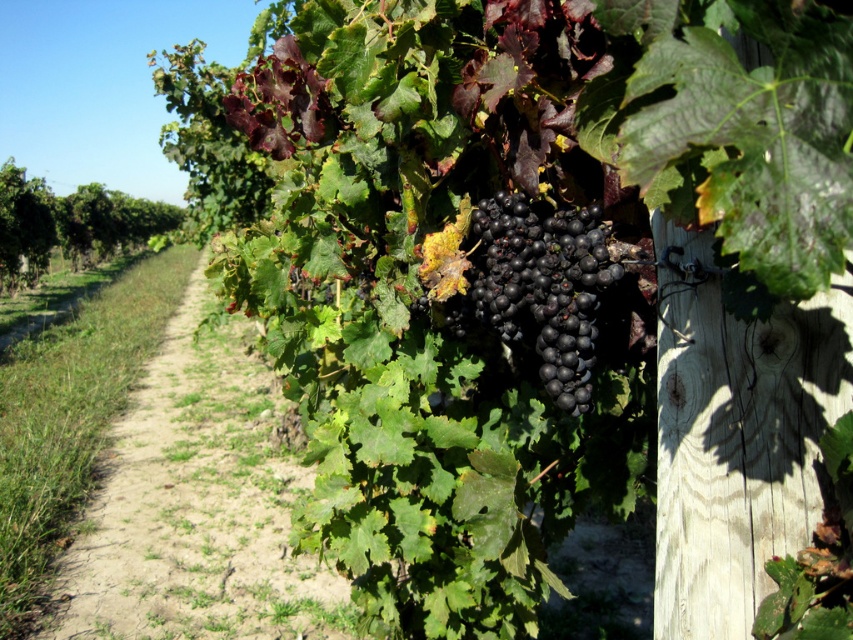
You are a gardener who needs to cross from one side of the vineyard to the other. You see the dirt path at center and the shiny black grapes at center. Which one is farther away from your current position if you are standing at the edge of the vineyard?

The dirt path at center and shiny black grapes at center are 3.72 meters apart. Since you are standing at the edge of the vineyard, the object farther away would depend on their positions relative to you. However, without specific directional information, it is impossible to determine which is farther away.

You are a gardener with a 1.2 meter wide tractor. You need to drive along the dirt path at center while avoiding the shiny black grapes at center. Can your tractor fit on the path without touching the grapes?

The dirt path at center might be wider than shiny black grapes at center, so there is a possibility that the tractor can fit, but it depends on the exact width difference between the path and the grapes. If the path is indeed wider, then the tractor should be able to pass safely without touching the grapes.